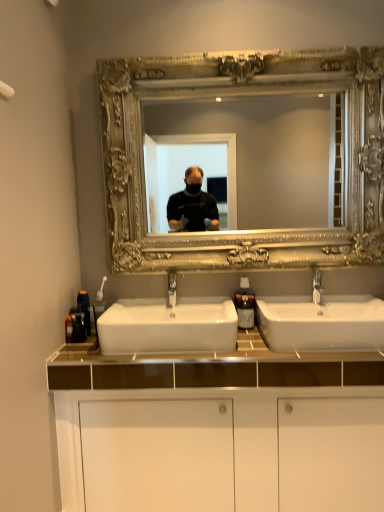
Question: From the image's perspective, is silver metallic faucet at center above white glossy cabinet at center?

Choices:
 (A) yes
 (B) no

Answer: (A)

Question: Can you confirm if silver metallic faucet at center is positioned to the left of white glossy cabinet at center?

Choices:
 (A) yes
 (B) no

Answer: (B)

Question: Is silver metallic faucet at center with white glossy cabinet at center?

Choices:
 (A) no
 (B) yes

Answer: (A)

Question: Is the position of silver metallic faucet at center less distant than that of white glossy cabinet at center?

Choices:
 (A) yes
 (B) no

Answer: (B)

Question: Does silver metallic faucet at center have a lesser width compared to white glossy cabinet at center?

Choices:
 (A) yes
 (B) no

Answer: (A)

Question: Is there a large distance between silver metallic faucet at center and white glossy cabinet at center?

Choices:
 (A) no
 (B) yes

Answer: (A)

Question: Is silver ornate mirror at upper center oriented away from translucent plastic soap dispenser at center, arranged as the 2th soap dispenser when viewed from the left?

Choices:
 (A) yes
 (B) no

Answer: (B)

Question: Does silver ornate mirror at upper center turn towards translucent plastic soap dispenser at center, which is counted as the 1th soap dispenser, starting from the right?

Choices:
 (A) no
 (B) yes

Answer: (A)

Question: Considering the relative positions of silver ornate mirror at upper center and translucent plastic soap dispenser at center, arranged as the 2th soap dispenser when viewed from the left, in the image provided, is silver ornate mirror at upper center to the left of translucent plastic soap dispenser at center, arranged as the 2th soap dispenser when viewed from the left, from the viewer's perspective?

Choices:
 (A) no
 (B) yes

Answer: (B)

Question: Considering the relative sizes of silver ornate mirror at upper center and translucent plastic soap dispenser at center, which is counted as the 1th soap dispenser, starting from the right, in the image provided, is silver ornate mirror at upper center wider than translucent plastic soap dispenser at center, which is counted as the 1th soap dispenser, starting from the right,?

Choices:
 (A) no
 (B) yes

Answer: (B)

Question: Does silver ornate mirror at upper center come in front of translucent plastic soap dispenser at center, arranged as the 2th soap dispenser when viewed from the left?

Choices:
 (A) yes
 (B) no

Answer: (A)

Question: Could translucent plastic soap dispenser at center, which is counted as the 1th soap dispenser, starting from the right, be considered to be inside silver ornate mirror at upper center?

Choices:
 (A) yes
 (B) no

Answer: (B)

Question: Is silver ornate mirror at upper center facing towards white glossy sink at center, the first sink when ordered from right to left?

Choices:
 (A) no
 (B) yes

Answer: (A)